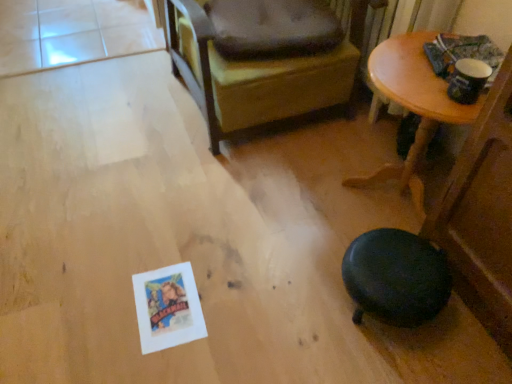
Question: Is dark brown fabric dog bed at upper center further to the viewer compared to wooden table at upper right?

Choices:
 (A) yes
 (B) no

Answer: (A)

Question: Considering the relative sizes of dark brown fabric dog bed at upper center and wooden table at upper right in the image provided, is dark brown fabric dog bed at upper center thinner than wooden table at upper right?

Choices:
 (A) yes
 (B) no

Answer: (A)

Question: Could you tell me if dark brown fabric dog bed at upper center is turned towards wooden table at upper right?

Choices:
 (A) no
 (B) yes

Answer: (A)

Question: Does dark brown fabric dog bed at upper center have a greater width compared to wooden table at upper right?

Choices:
 (A) no
 (B) yes

Answer: (A)

Question: Can you confirm if dark brown fabric dog bed at upper center is positioned to the right of wooden table at upper right?

Choices:
 (A) yes
 (B) no

Answer: (B)

Question: Is dark brown fabric dog bed at upper center outside of wooden table at upper right?

Choices:
 (A) yes
 (B) no

Answer: (A)

Question: Is dark brown fabric dog bed at upper center not inside dark brown leather chair at center?

Choices:
 (A) no
 (B) yes

Answer: (A)

Question: Is dark brown fabric dog bed at upper center facing towards dark brown leather chair at center?

Choices:
 (A) no
 (B) yes

Answer: (B)

Question: Is dark brown leather chair at center a part of dark brown fabric dog bed at upper center?

Choices:
 (A) no
 (B) yes

Answer: (A)

Question: From the image's perspective, is dark brown fabric dog bed at upper center over dark brown leather chair at center?

Choices:
 (A) yes
 (B) no

Answer: (B)

Question: From a real-world perspective, is dark brown fabric dog bed at upper center positioned under dark brown leather chair at center based on gravity?

Choices:
 (A) no
 (B) yes

Answer: (A)

Question: Can you confirm if dark brown fabric dog bed at upper center is shorter than dark brown leather chair at center?

Choices:
 (A) no
 (B) yes

Answer: (B)

Question: From the image's perspective, would you say dark brown leather chair at center is shown under dark brown fabric dog bed at upper center?

Choices:
 (A) yes
 (B) no

Answer: (B)